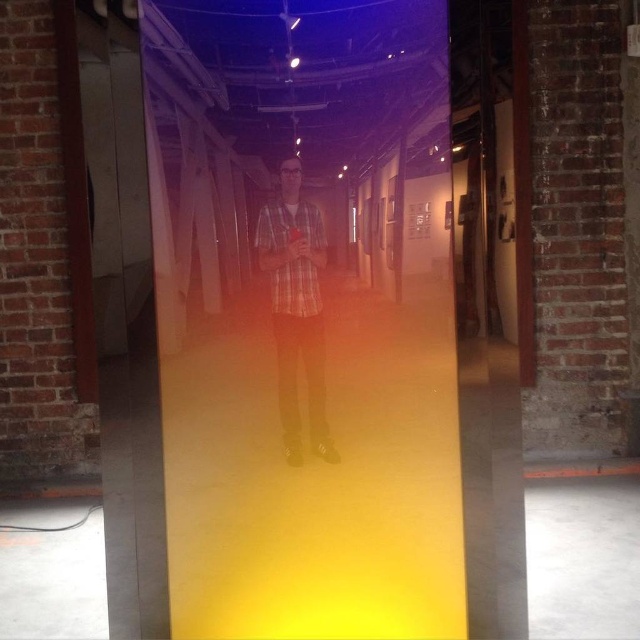
Question: Is transparent glass door at center wider than plaid shirt at center?

Choices:
 (A) yes
 (B) no

Answer: (A)

Question: Is transparent glass door at center below plaid shirt at center?

Choices:
 (A) no
 (B) yes

Answer: (B)

Question: Which point is closer to the camera?

Choices:
 (A) (275, 221)
 (B) (349, 454)

Answer: (A)

Question: Which object is farther from the camera taking this photo?

Choices:
 (A) transparent glass door at center
 (B) plaid shirt at center

Answer: (B)

Question: Does transparent glass door at center appear over plaid shirt at center?

Choices:
 (A) yes
 (B) no

Answer: (B)